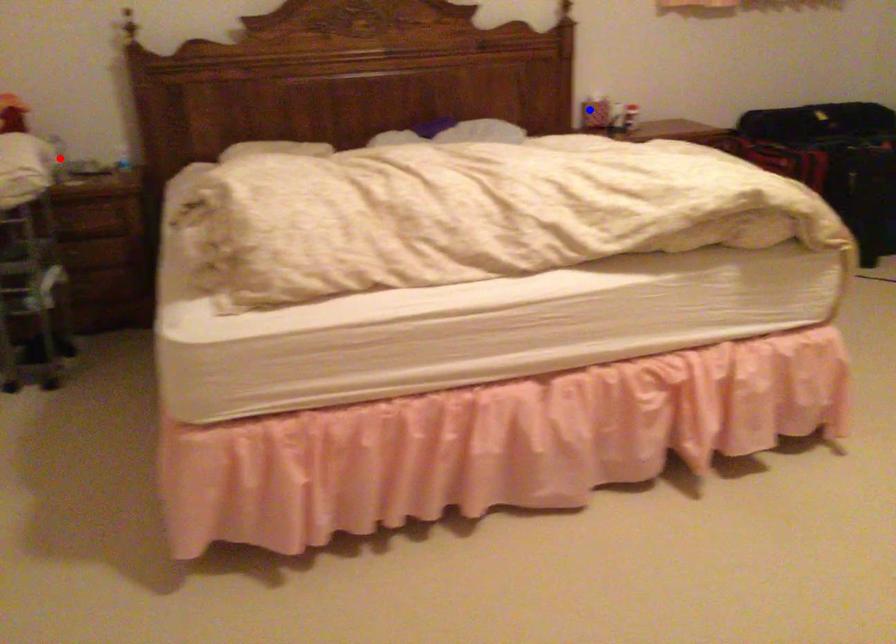
Question: Two points are marked on the image. Which point is closer to the camera?

Choices:
 (A) Blue point is closer.
 (B) Red point is closer.

Answer: (B)